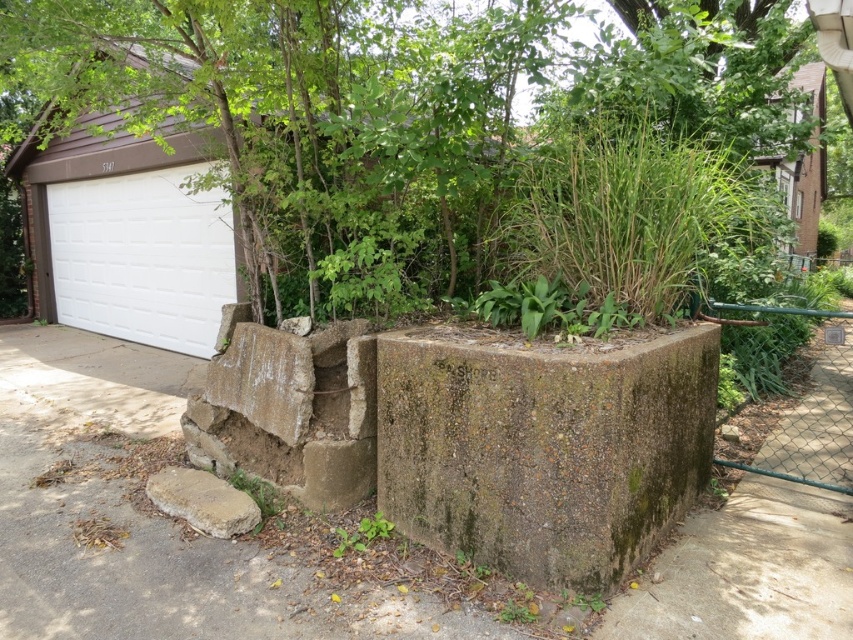
You are standing at the point with coordinates point (834, 442) and want to walk to the point with coordinates point (202, 305). Which direction should you move in?

You should move towards the direction of point (202, 305), which is behind point (834, 442), so you need to move backward.

You are planning to plant a new tree in your backyard. You have a space that can accommodate a tree up to the width of the brown rough stone at lower left. Based on the scene, will the green leafy tree at center fit in that space?

The green leafy tree at center has a lesser width compared to the brown rough stone at lower left, so yes, it will fit in the space allocated for the brown rough stone at lower left.